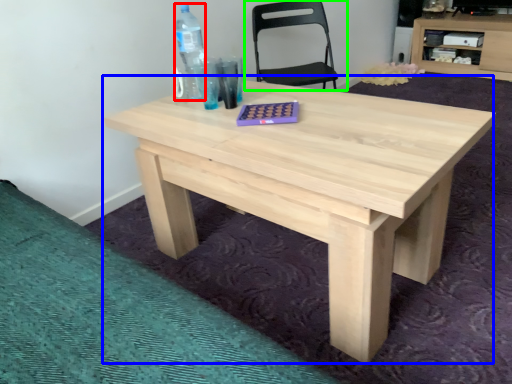
Question: Estimate the real-world distances between objects in this image. Which object is farther from bottle (highlighted by a red box), table (highlighted by a blue box) or chair (highlighted by a green box)?

Choices:
 (A) table
 (B) chair

Answer: (B)